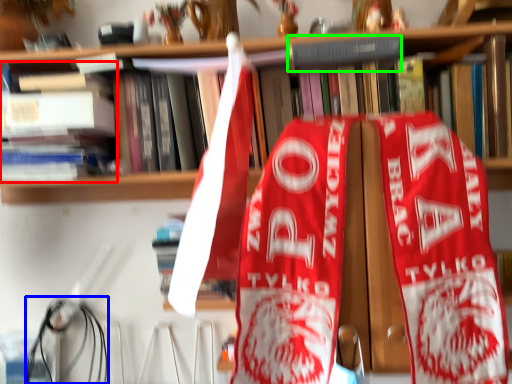
Question: Which is farther away from book (highlighted by a red box)? wire (highlighted by a blue box) or book (highlighted by a green box)?

Choices:
 (A) wire
 (B) book

Answer: (B)